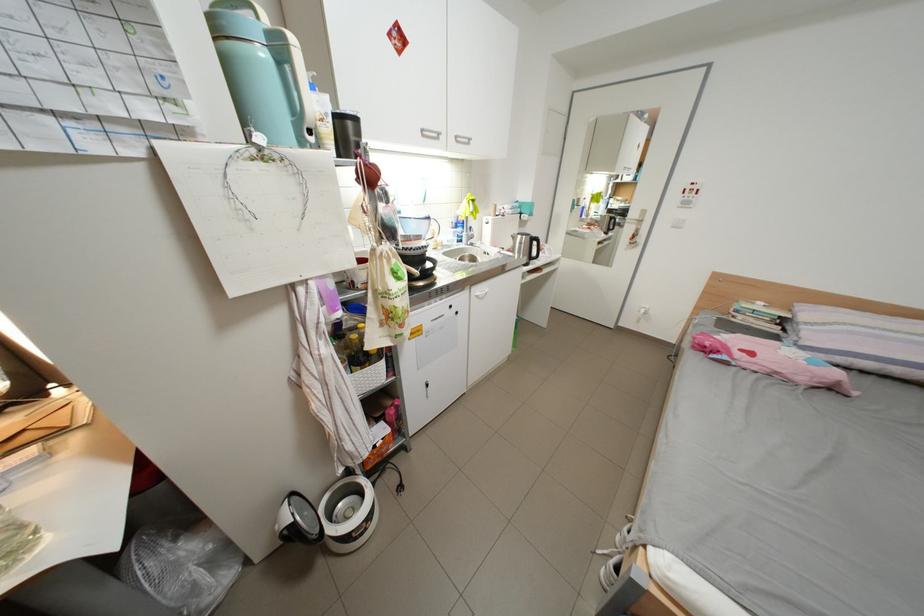
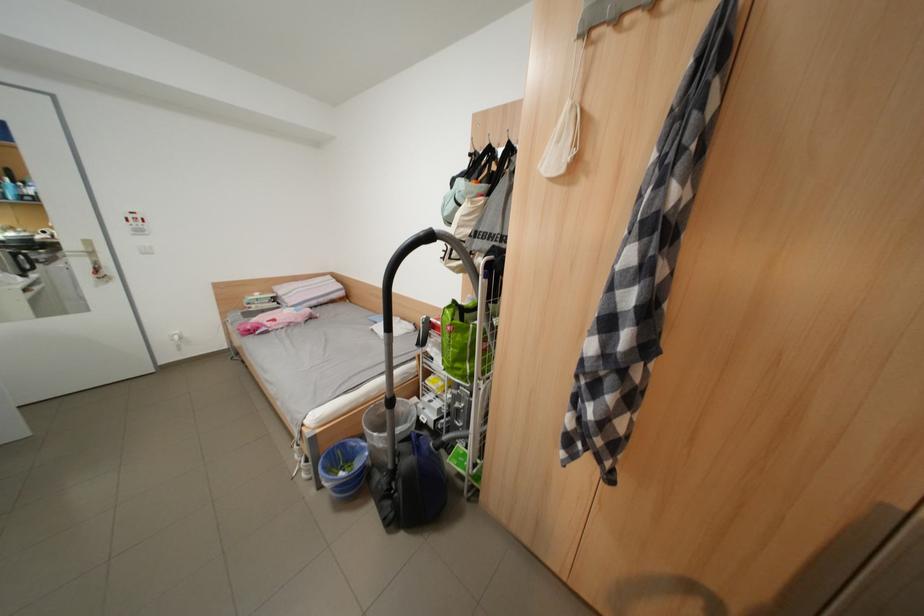
Find the pixel in the second image that matches point (700, 188) in the first image.

(142, 217)